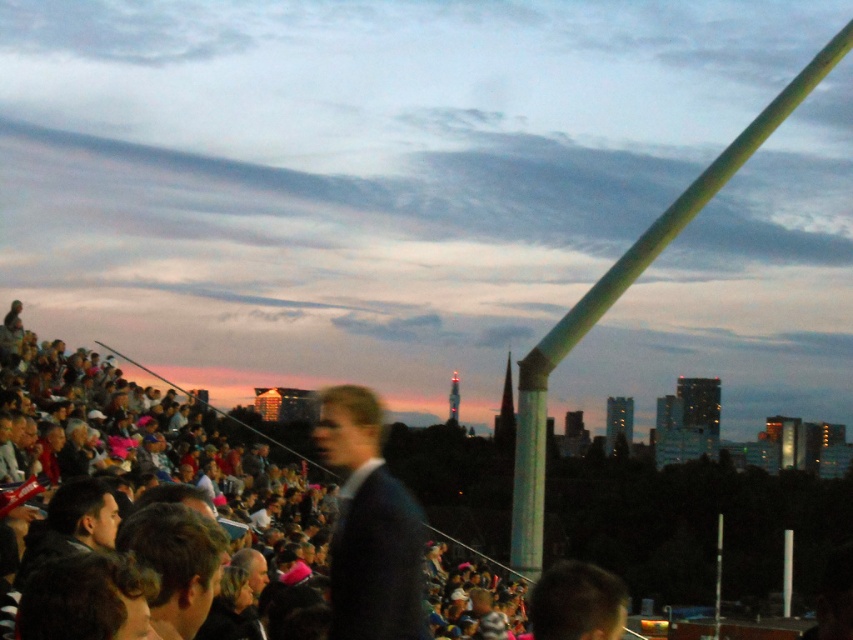
Question: Estimate the real-world distances between objects in this image. Which object is closer to the dark brown hair at center?

Choices:
 (A) dark blue suit at center
 (B) green glossy pole at upper right

Answer: (A)

Question: Which point is closer to the camera?

Choices:
 (A) pos(195,564)
 (B) pos(315,440)

Answer: (A)

Question: Is dark blue suit at center behind dark brown hair at center?

Choices:
 (A) no
 (B) yes

Answer: (B)

Question: Is dark blue suit at center positioned at the back of green glossy pole at upper right?

Choices:
 (A) no
 (B) yes

Answer: (A)

Question: Is dark blue suit at center further to the viewer compared to dark brown hair at center?

Choices:
 (A) no
 (B) yes

Answer: (B)

Question: Which point is farther from the camera taking this photo?

Choices:
 (A) (409, 545)
 (B) (601, 310)
 (C) (132, 540)

Answer: (B)